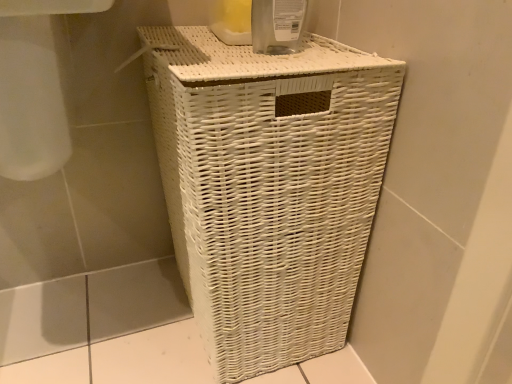
What are the coordinates of `vacant space situated on the left part of transparent plastic bottle at upper center` in the screenshot? It's located at (209, 49).